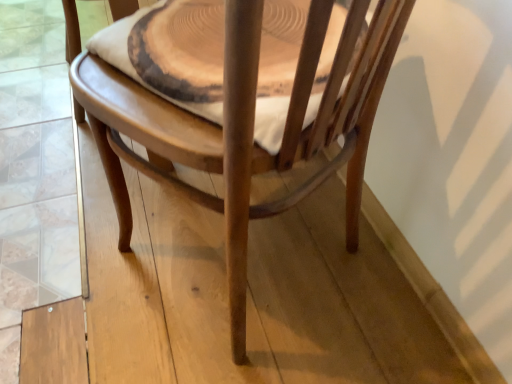
The width and height of the screenshot is (512, 384). I want to click on wooden round table at center, so 170,52.

This screenshot has width=512, height=384. Describe the element at coordinates (170, 52) in the screenshot. I see `wooden round table at center` at that location.

Describe the element at coordinates (241, 125) in the screenshot. I see `wooden chair at center` at that location.

This screenshot has height=384, width=512. What are the coordinates of `wooden chair at center` in the screenshot? It's located at (241, 125).

Where is `wooden round table at center`? Image resolution: width=512 pixels, height=384 pixels. wooden round table at center is located at coordinates (170, 52).

Can you confirm if wooden round table at center is positioned to the left of wooden chair at center?

In fact, wooden round table at center is to the right of wooden chair at center.

Which object is further away from the camera taking this photo, wooden round table at center or wooden chair at center?

wooden round table at center is behind.

Is point (93, 42) farther from camera compared to point (245, 140)?

Yes, point (93, 42) is behind point (245, 140).

From the image's perspective, between wooden round table at center and wooden chair at center, who is located below?

wooden chair at center appears lower in the image.

From a real-world perspective, is wooden round table at center on wooden chair at center?

Indeed, from a real-world perspective, wooden round table at center stands above wooden chair at center.

Considering the sizes of objects wooden round table at center and wooden chair at center in the image provided, who is thinner, wooden round table at center or wooden chair at center?

With smaller width is wooden round table at center.

In terms of height, does wooden round table at center look taller or shorter compared to wooden chair at center?

Clearly, wooden round table at center is shorter compared to wooden chair at center.

Based on the photo, between wooden round table at center and wooden chair at center, which one has smaller size?

wooden round table at center is smaller.

Is wooden round table at center not within wooden chair at center?

No, wooden round table at center is inside wooden chair at center's boundary.

Is wooden round table at center next to wooden chair at center and touching it?

There is a gap between wooden round table at center and wooden chair at center.

Is wooden round table at center looking in the opposite direction of wooden chair at center?

Yes, wooden round table at center is positioned with its back facing wooden chair at center.

Measure the distance between wooden round table at center and wooden chair at center.

A distance of 4.46 inches exists between wooden round table at center and wooden chair at center.

You are a GUI agent. You are given a task and a screenshot of the screen. Output one action in this format:
    pyautogui.click(x=<x>, y=<y>)
    Task: Click on the round table behind the wooden chair at center
    
    Given the screenshot: What is the action you would take?
    pyautogui.click(x=170, y=52)

Which is more to the left, wooden chair at center or wooden round table at center?

wooden chair at center.

Does wooden chair at center come in front of wooden round table at center?

Yes.

Does point (399, 11) lie in front of point (144, 85)?

Yes, it is in front of point (144, 85).

From the image's perspective, would you say wooden chair at center is shown under wooden round table at center?

Correct, wooden chair at center appears lower than wooden round table at center in the image.

From a real-world perspective, is wooden chair at center physically below wooden round table at center?

Yes, from a real-world perspective, wooden chair at center is under wooden round table at center.

Is wooden chair at center wider or thinner than wooden round table at center?

Considering their sizes, wooden chair at center looks broader than wooden round table at center.

Which of these two, wooden chair at center or wooden round table at center, stands taller?

With more height is wooden chair at center.

Considering the relative sizes of wooden chair at center and wooden round table at center in the image provided, is wooden chair at center smaller than wooden round table at center?

Incorrect, wooden chair at center is not smaller in size than wooden round table at center.

Which is correct: wooden chair at center is inside wooden round table at center, or outside of it?

The correct answer is: outside.

Are wooden chair at center and wooden round table at center located far from each other?

That's not correct — wooden chair at center is a little close to wooden round table at center.

Is wooden chair at center facing towards wooden round table at center?

Yes, wooden chair at center is aimed at wooden round table at center.

How different are the orientations of wooden chair at center and wooden round table at center in degrees?

1.3 degrees separate the facing orientations of wooden chair at center and wooden round table at center.

Measure the distance between wooden chair at center and wooden round table at center.

wooden chair at center and wooden round table at center are 4.46 inches apart.

I want to click on round table behind the wooden chair at center, so click(170, 52).

The image size is (512, 384). I want to click on round table above the wooden chair at center (from a real-world perspective), so click(x=170, y=52).

This screenshot has height=384, width=512. Identify the location of chair in front of the wooden round table at center. (241, 125).